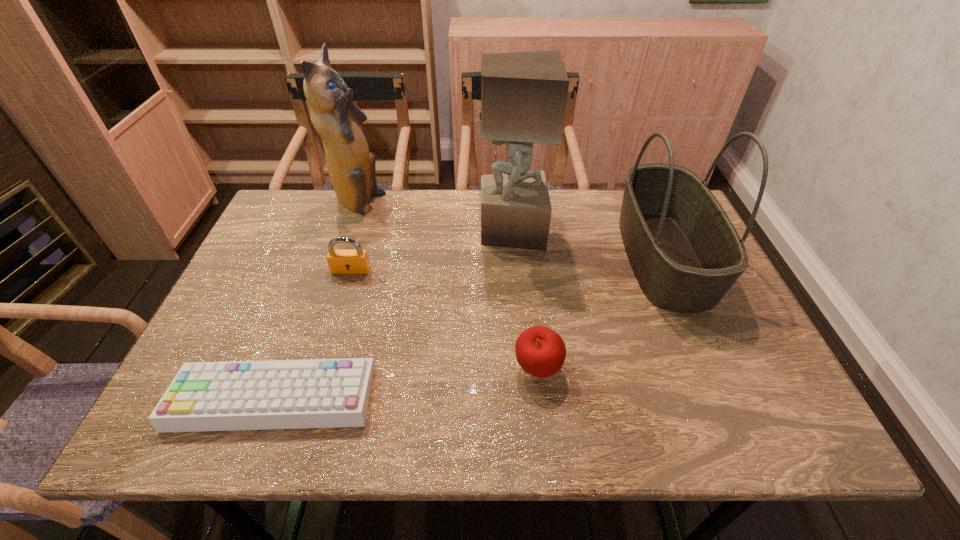
The width and height of the screenshot is (960, 540). I want to click on free region located on the face of the cat, so click(x=476, y=204).

This screenshot has width=960, height=540. Identify the location of vacant space located on the front of the rightmost object. (734, 421).

Identify the location of vacant space located to unlock the padlock from the front. This screenshot has width=960, height=540. (321, 373).

Find the location of a particular element. This screenshot has width=960, height=540. vacant region located on the right of the apple is located at coordinates (589, 369).

At what (x,y) coordinates should I click in order to perform the action: click on free space located on the right of the shortest object. Please return your answer as a coordinate pair (x, y). The height and width of the screenshot is (540, 960). Looking at the image, I should click on tap(458, 397).

The height and width of the screenshot is (540, 960). I want to click on sculpture that is at the far edge, so click(523, 94).

Image resolution: width=960 pixels, height=540 pixels. In order to click on cat present at the far edge in this screenshot , I will do `click(351, 167)`.

The image size is (960, 540). Find the location of `basket positioned at the far edge`. basket positioned at the far edge is located at coordinates (686, 254).

The width and height of the screenshot is (960, 540). In order to click on object located in the near edge section of the desktop in this screenshot , I will do click(x=315, y=393).

Find the location of a particular element. object that is at the left edge is located at coordinates (315, 393).